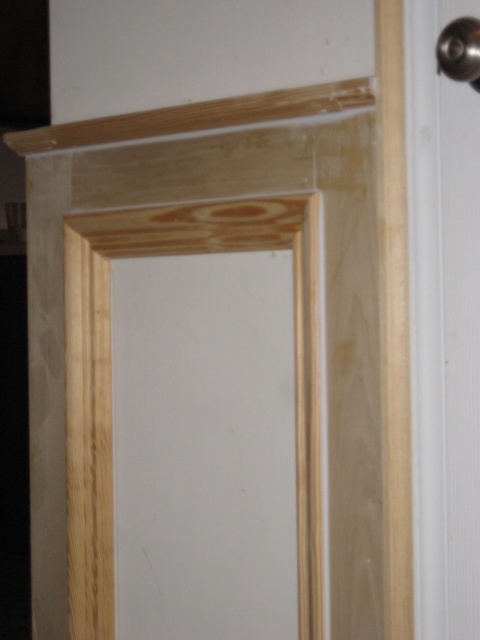
Question: Is natural wood door at center further to camera compared to polished metal door handle at upper right?

Choices:
 (A) yes
 (B) no

Answer: (A)

Question: Which object is closer to the camera taking this photo?

Choices:
 (A) natural wood door at center
 (B) polished metal door handle at upper right

Answer: (B)

Question: Can you confirm if natural wood door at center is wider than polished metal door handle at upper right?

Choices:
 (A) no
 (B) yes

Answer: (B)

Question: Which of the following is the farthest from the observer?

Choices:
 (A) polished metal door handle at upper right
 (B) natural wood door at center

Answer: (B)

Question: In this image, where is natural wood door at center located relative to polished metal door handle at upper right?

Choices:
 (A) left
 (B) right

Answer: (A)